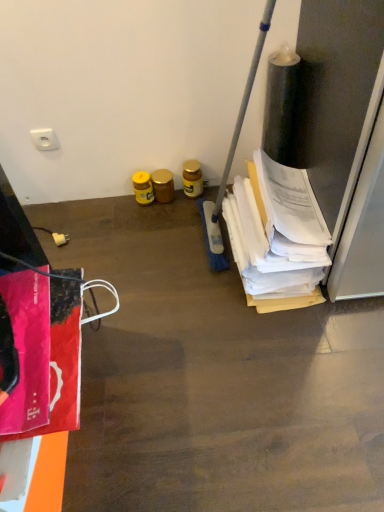
Question: Considering the relative sizes of gold metallic jar at center, which is counted as the 2th bottle, starting from the right, and white plastic socket at upper left, placed as the 2th power plugs and sockets when sorted from bottom to top, in the image provided, is gold metallic jar at center, which is counted as the 2th bottle, starting from the right, taller than white plastic socket at upper left, placed as the 2th power plugs and sockets when sorted from bottom to top,?

Choices:
 (A) yes
 (B) no

Answer: (A)

Question: Considering the relative sizes of gold metallic jar at center, which is counted as the 2th bottle, starting from the right, and white plastic socket at upper left, which is the 1th power plugs and sockets from top to bottom, in the image provided, is gold metallic jar at center, which is counted as the 2th bottle, starting from the right, thinner than white plastic socket at upper left, which is the 1th power plugs and sockets from top to bottom,?

Choices:
 (A) yes
 (B) no

Answer: (B)

Question: Is gold metallic jar at center, which is counted as the 2th bottle, starting from the right, outside white plastic socket at upper left, which is the 1th power plugs and sockets from top to bottom?

Choices:
 (A) yes
 (B) no

Answer: (A)

Question: Could white plastic socket at upper left, placed as the 2th power plugs and sockets when sorted from bottom to top, be considered to be inside gold metallic jar at center, which is counted as the 2th bottle, starting from the right?

Choices:
 (A) yes
 (B) no

Answer: (B)

Question: From the image's perspective, is gold metallic jar at center, which is counted as the 2th bottle, starting from the right, above white plastic socket at upper left, placed as the 2th power plugs and sockets when sorted from bottom to top?

Choices:
 (A) no
 (B) yes

Answer: (A)

Question: Based on their sizes in the image, would you say white paper at right is bigger or smaller than white plastic plug at lower left, the second power plugs and sockets positioned from the top?

Choices:
 (A) small
 (B) big

Answer: (B)

Question: Is white paper at right taller or shorter than white plastic plug at lower left, the first power plugs and sockets in the bottom-to-top sequence?

Choices:
 (A) short
 (B) tall

Answer: (B)

Question: From the image's perspective, relative to white plastic plug at lower left, the first power plugs and sockets in the bottom-to-top sequence, is white paper at right above or below?

Choices:
 (A) below
 (B) above

Answer: (B)

Question: Relative to white plastic plug at lower left, the second power plugs and sockets positioned from the top, is white paper at right in front or behind?

Choices:
 (A) behind
 (B) front

Answer: (B)

Question: Is white plastic socket at upper left, which is the 1th power plugs and sockets from top to bottom, inside or outside of white plastic plug at lower left, the second power plugs and sockets positioned from the top?

Choices:
 (A) outside
 (B) inside

Answer: (A)

Question: Considering the positions of point (44, 145) and point (62, 244), is point (44, 145) closer or farther from the camera than point (62, 244)?

Choices:
 (A) farther
 (B) closer

Answer: (B)

Question: Visually, is white plastic socket at upper left, which is the 1th power plugs and sockets from top to bottom, positioned to the left or to the right of white plastic plug at lower left, the first power plugs and sockets in the bottom-to-top sequence?

Choices:
 (A) right
 (B) left

Answer: (B)

Question: Relative to white plastic plug at lower left, the first power plugs and sockets in the bottom-to-top sequence, is white plastic socket at upper left, placed as the 2th power plugs and sockets when sorted from bottom to top, in front or behind?

Choices:
 (A) front
 (B) behind

Answer: (A)

Question: Do you think white plastic socket at upper left, which is the 1th power plugs and sockets from top to bottom, is within white paper at right, or outside of it?

Choices:
 (A) outside
 (B) inside

Answer: (A)

Question: In terms of height, does white plastic socket at upper left, placed as the 2th power plugs and sockets when sorted from bottom to top, look taller or shorter compared to white paper at right?

Choices:
 (A) short
 (B) tall

Answer: (A)